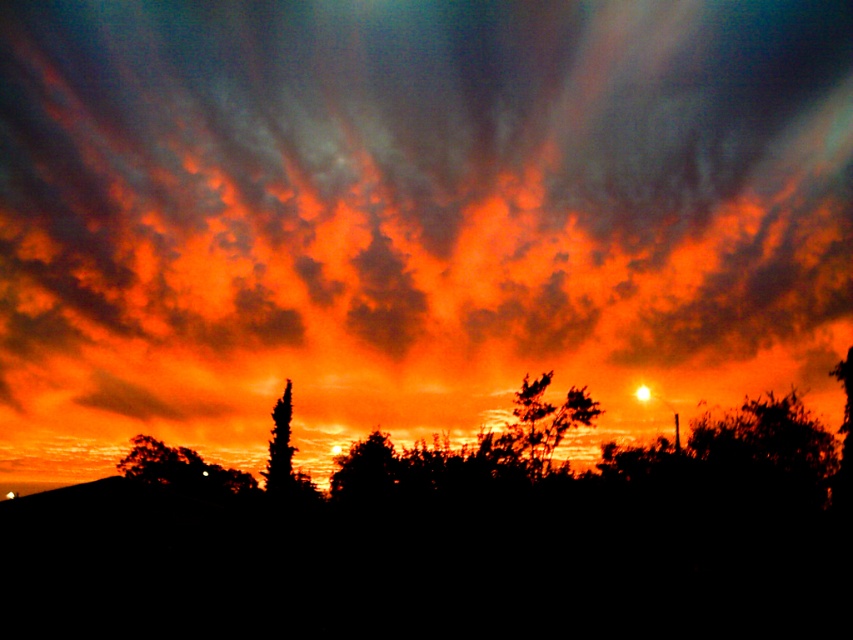
Question: Does orange matte cloud at upper center appear on the right side of silhouette evergreen tree at center?

Choices:
 (A) yes
 (B) no

Answer: (A)

Question: Observing the image, what is the correct spatial positioning of orange matte cloud at upper center in reference to silhouette tree at center?

Choices:
 (A) left
 (B) right

Answer: (B)

Question: Estimate the real-world distances between objects in this image. Which object is farther from the orange matte cloud at upper center?

Choices:
 (A) silhouette evergreen tree at center
 (B) silhouette leafy tree at center

Answer: (B)

Question: Is orange matte cloud at upper center further to camera compared to silhouette leafy tree at center?

Choices:
 (A) yes
 (B) no

Answer: (A)

Question: Which object is the farthest from the silhouette evergreen tree at center?

Choices:
 (A) orange matte cloud at upper center
 (B) silhouette leafy tree at center
 (C) silhouette tree at center

Answer: (B)

Question: Which point is farther from the camera taking this photo?

Choices:
 (A) (279, 426)
 (B) (572, 253)
 (C) (546, 436)

Answer: (B)